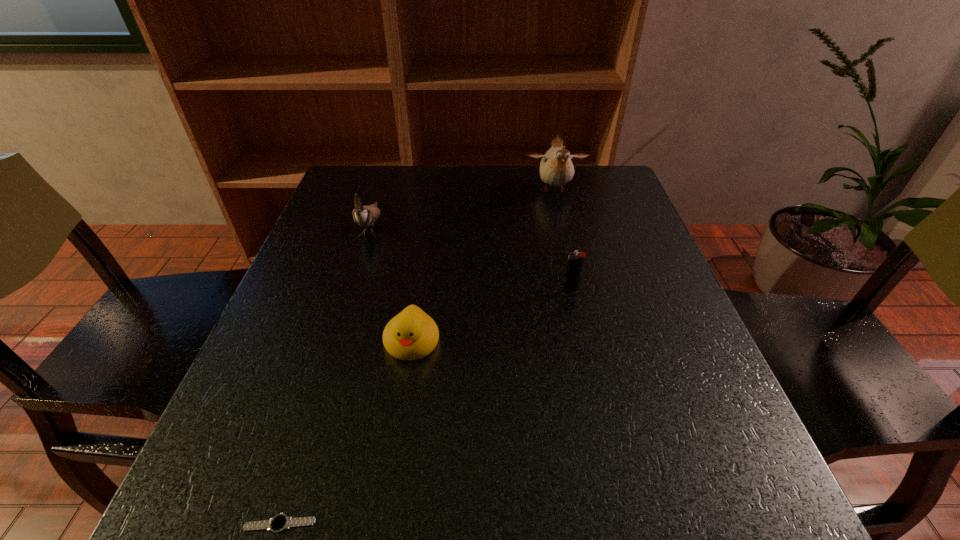
You are a GUI agent. You are given a task and a screenshot of the screen. Output one action in this format:
    pyautogui.click(x=<x>, y=<y>)
    Task: Click on the empty location between the nearest object and the left bird
    
    Given the screenshot: What is the action you would take?
    pyautogui.click(x=325, y=374)

The height and width of the screenshot is (540, 960). In order to click on unoccupied area between the nearest object and the shorter bird in this screenshot , I will do `click(325, 374)`.

The height and width of the screenshot is (540, 960). In order to click on empty location between the duckling and the watch in this screenshot , I will do `click(346, 433)`.

Locate an element on the screen. The width and height of the screenshot is (960, 540). vacant area that lies between the watch and the nearer bird is located at coordinates (325, 374).

Find the location of a particular element. The width and height of the screenshot is (960, 540). free space between the third object from left to right and the fourth shortest object is located at coordinates (392, 284).

Where is `object that is the fourth closest to the third tallest object`? This screenshot has height=540, width=960. object that is the fourth closest to the third tallest object is located at coordinates tap(279, 523).

This screenshot has width=960, height=540. Identify the location of object that is the third closest one to the nearest object. (365, 216).

Image resolution: width=960 pixels, height=540 pixels. Find the location of `free spot that satisfies the following two spatial constraints: 1. on the back side of the third tallest object; 2. on the left side of the watch`. free spot that satisfies the following two spatial constraints: 1. on the back side of the third tallest object; 2. on the left side of the watch is located at coordinates (352, 292).